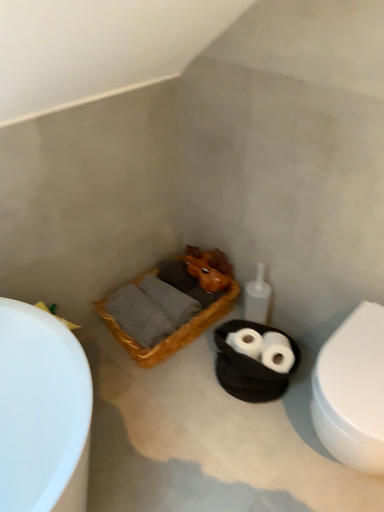
I want to click on free space above black woven basket at center (from a real-world perspective), so click(x=258, y=346).